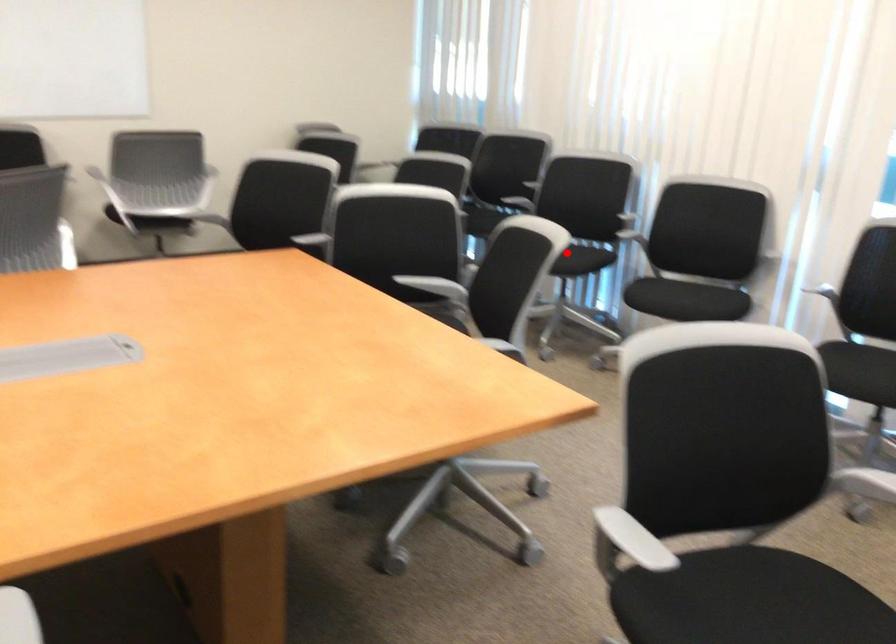
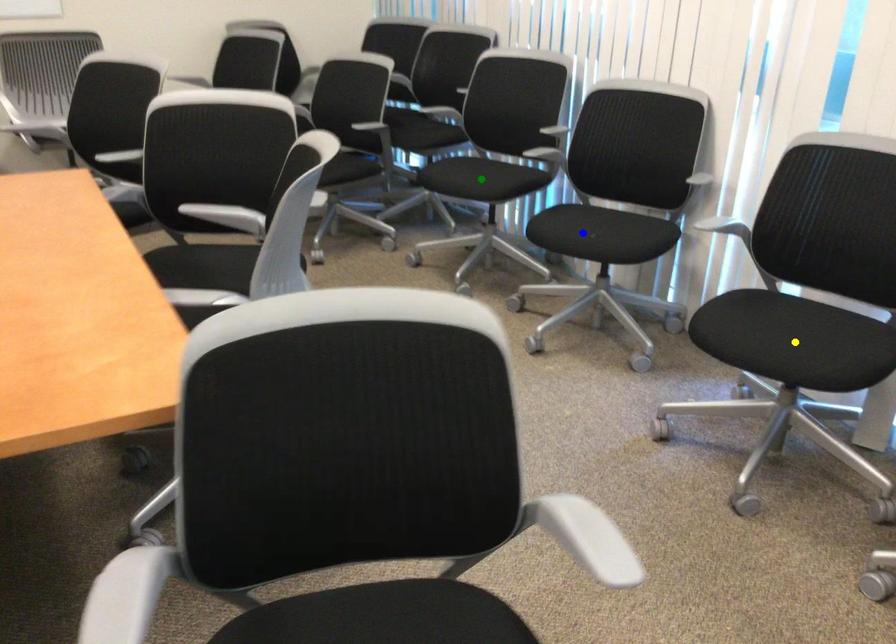
Question: I am providing you with two images of the same scene from different viewpoints. A red point is marked on the first image. You are given multiple points on the second image. In image 2, which mark is for the same physical point as the one in image 1?

Choices:
 (A) green point
 (B) blue point
 (C) yellow point

Answer: (A)